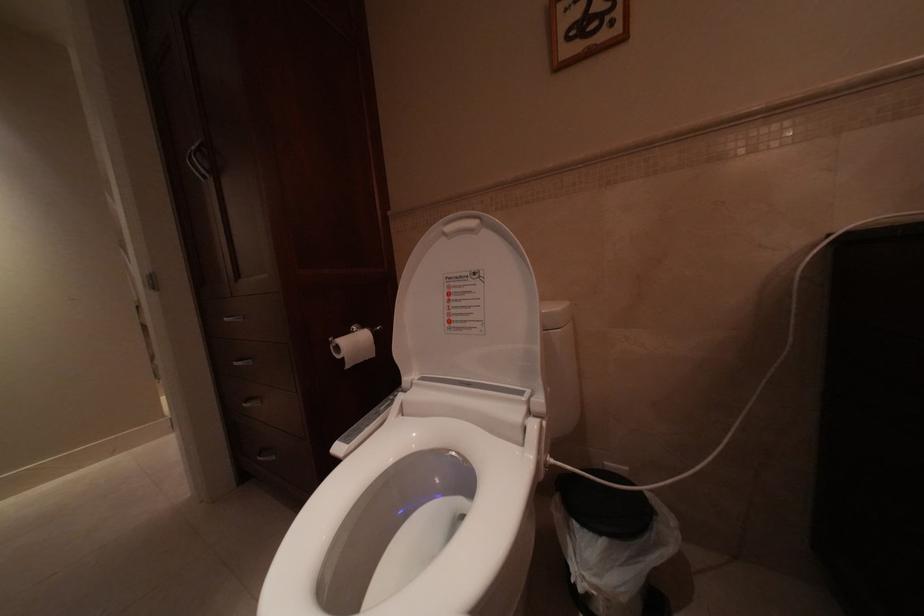
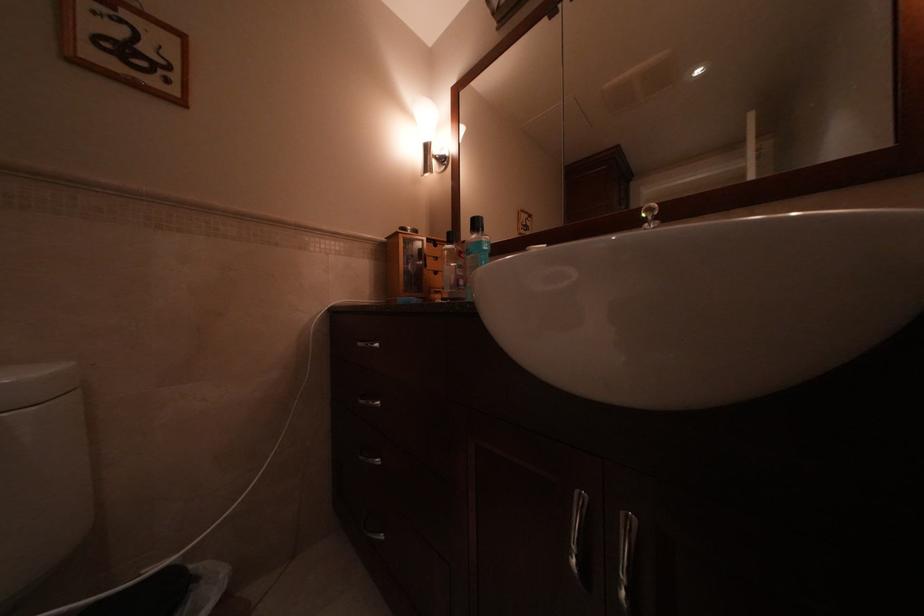
Question: The images are taken continuously from a first-person perspective. In which direction is your viewpoint rotating?

Choices:
 (A) Left
 (B) Right
 (C) Up
 (D) Down

Answer: (B)